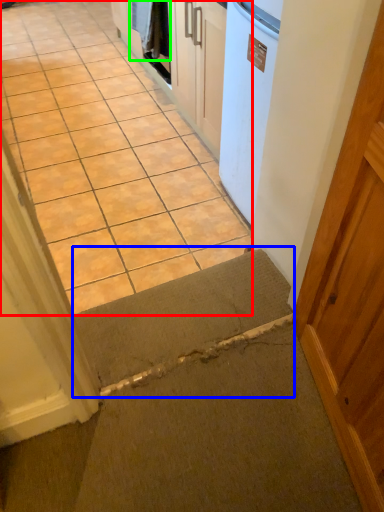
Question: Which object is the farthest from concrete (highlighted by a red box)? Choose among these: doormat (highlighted by a blue box) or laundry (highlighted by a green box).

Choices:
 (A) doormat
 (B) laundry

Answer: (A)